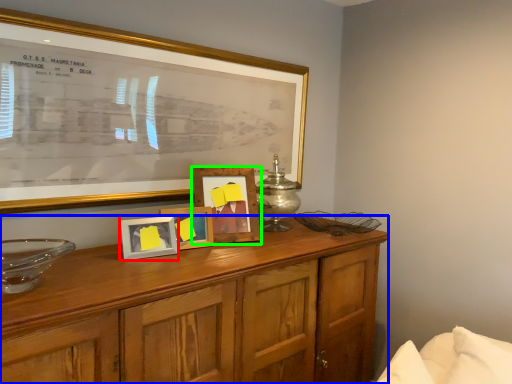
Question: Considering the real-world distances, which object is farthest from picture frame (highlighted by a red box)? cabinetry (highlighted by a blue box) or picture frame (highlighted by a green box)?

Choices:
 (A) cabinetry
 (B) picture frame

Answer: (A)